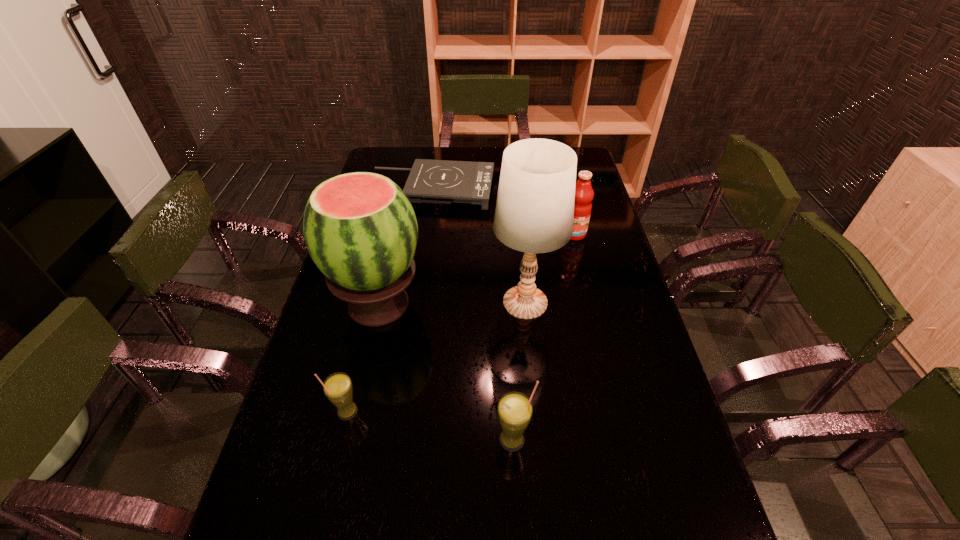
You are a GUI agent. You are given a task and a screenshot of the screen. Output one action in this format:
    pyautogui.click(x=<x>, y=<y>)
    Task: Click on the vacant area situated on the right of the second nearest object
    The height and width of the screenshot is (540, 960).
    Given the screenshot: What is the action you would take?
    pyautogui.click(x=473, y=411)

The width and height of the screenshot is (960, 540). In order to click on free space located 0.350m on the left of the right straw for drinking in this screenshot , I will do [x=342, y=440].

You are a GUI agent. You are given a task and a screenshot of the screen. Output one action in this format:
    pyautogui.click(x=<x>, y=<y>)
    Task: Click on the vacant space located 0.160m on the front of the hotplate
    The width and height of the screenshot is (960, 540).
    Given the screenshot: What is the action you would take?
    click(x=426, y=238)

The image size is (960, 540). I want to click on vacant area situated on the front label of the second farthest object, so click(581, 261).

This screenshot has width=960, height=540. Identify the location of vacant region located 0.350m on the left of the lamp. (373, 302).

Where is `free region located on the back of the watermelon`? The image size is (960, 540). free region located on the back of the watermelon is located at coordinates (396, 232).

The height and width of the screenshot is (540, 960). What are the coordinates of `object located in the far edge section of the desktop` in the screenshot? It's located at (430, 181).

The width and height of the screenshot is (960, 540). Identify the location of straw for drinking located at the left edge. (338, 388).

Where is `hotplate situated at the left edge`? hotplate situated at the left edge is located at coordinates (430, 181).

Find the location of `watermelon that is at the left edge`. watermelon that is at the left edge is located at coordinates (360, 229).